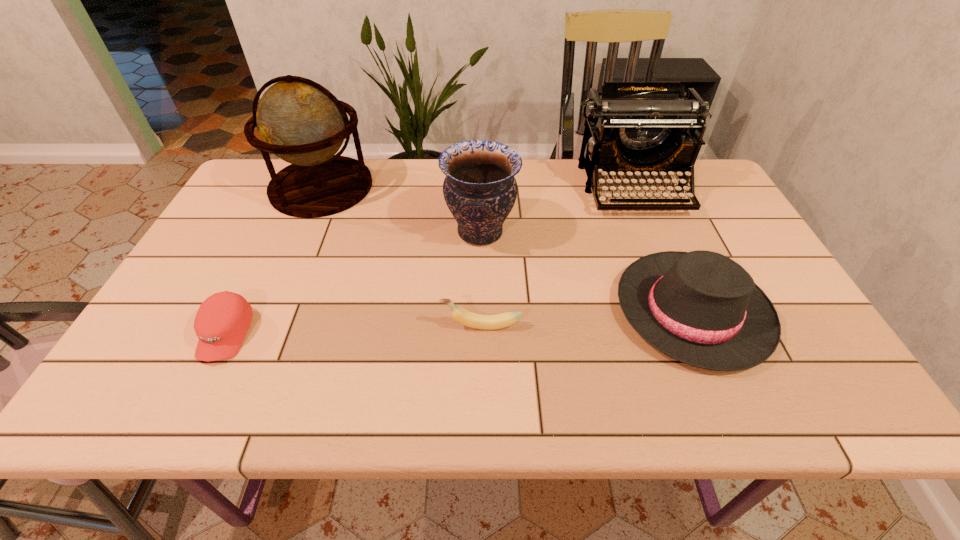
Where is `vacant space at the near left corner`? The image size is (960, 540). vacant space at the near left corner is located at coordinates (134, 413).

In order to click on free space between the tallest object and the dress hat in this screenshot , I will do `click(507, 249)`.

Where is `vacant space in between the pottery and the globe`? vacant space in between the pottery and the globe is located at coordinates (401, 210).

Find the location of a particular element. free space between the tallest object and the dress hat is located at coordinates (507, 249).

What are the coordinates of `free spot between the typewriter and the banana` in the screenshot? It's located at (558, 257).

Where is `vacant area that lies between the shortest object and the globe`? This screenshot has width=960, height=540. vacant area that lies between the shortest object and the globe is located at coordinates (274, 261).

Locate an element on the screen. The image size is (960, 540). free point between the typewriter and the shortest object is located at coordinates (430, 261).

The width and height of the screenshot is (960, 540). Identify the location of vacant area that lies between the globe and the second shortest object. [x=401, y=256].

Locate an element on the screen. blank region between the typewriter and the cap is located at coordinates (430, 261).

Locate an element on the screen. blank region between the globe and the pottery is located at coordinates (401, 210).